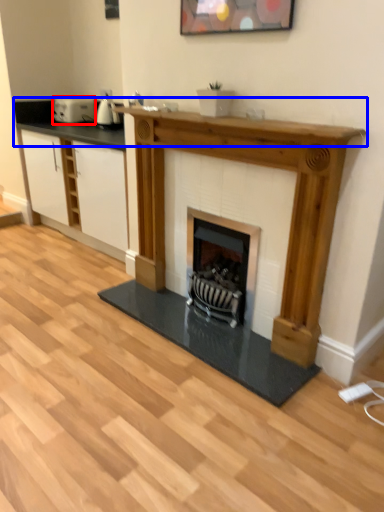
Question: Which object is closer to the camera taking this photo, appliance (highlighted by a red box) or counter top (highlighted by a blue box)?

Choices:
 (A) appliance
 (B) counter top

Answer: (B)